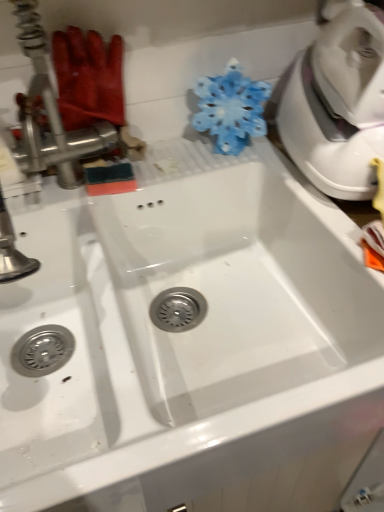
At what (x,y) coordinates should I click in order to perform the action: click on free space that is to the left of translucent plastic snowflake at upper center. Please return your answer as a coordinate pair (x, y). Looking at the image, I should click on (166, 159).